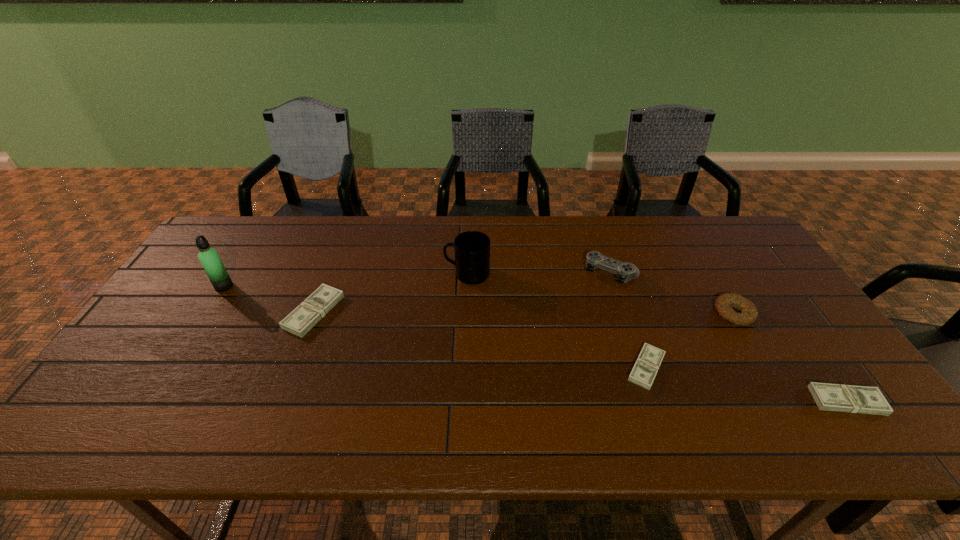
Locate an element on the screen. vacant space situated 0.160m on the back of the leftmost object is located at coordinates (248, 248).

You are a GUI agent. You are given a task and a screenshot of the screen. Output one action in this format:
    pyautogui.click(x=<x>, y=<y>)
    Task: Click on the free space located on the front of the fifth shortest object
    
    Given the screenshot: What is the action you would take?
    pyautogui.click(x=637, y=352)

Locate an element on the screen. The width and height of the screenshot is (960, 540). object that is at the far edge is located at coordinates (625, 271).

Where is `object that is at the left edge`? The image size is (960, 540). object that is at the left edge is located at coordinates (209, 257).

This screenshot has height=540, width=960. Identify the location of money present at the right edge. (831, 397).

Where is `bagel at the right edge`? This screenshot has width=960, height=540. bagel at the right edge is located at coordinates (749, 313).

Locate an element on the screen. The image size is (960, 540). object at the near right corner is located at coordinates (831, 397).

Identify the location of vacant area at the far edge. (683, 229).

This screenshot has height=540, width=960. Find the location of `vacant space at the left edge`. vacant space at the left edge is located at coordinates (161, 315).

Locate an element on the screen. This screenshot has height=540, width=960. free space at the far left corner is located at coordinates (258, 233).